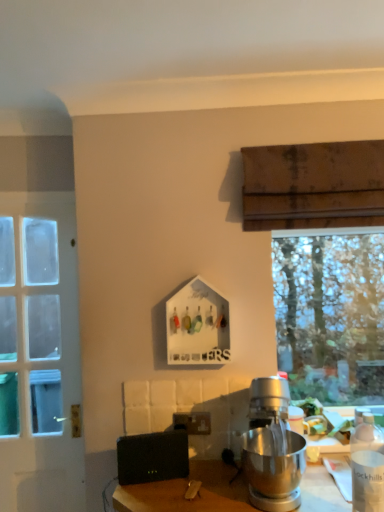
Find the location of a particular element. The height and width of the screenshot is (512, 384). free spot above white glass door at left (from a real-world perspective) is located at coordinates (36, 199).